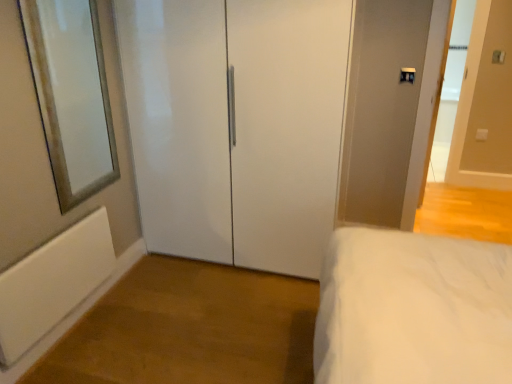
The height and width of the screenshot is (384, 512). What do you see at coordinates (485, 103) in the screenshot? I see `white glossy door at upper right, which is the first door in right-to-left order` at bounding box center [485, 103].

What do you see at coordinates (236, 126) in the screenshot? I see `white glossy closet doors at center, which is the second door in right-to-left order` at bounding box center [236, 126].

I want to click on white matte radiator at lower left, so [53, 283].

This screenshot has width=512, height=384. Identify the location of white glossy door at upper right, marked as the second door in a left-to-right arrangement. (485, 103).

Does white glossy closet doors at center, which is the second door in right-to-left order, lie behind white matte radiator at lower left?

Yes, white glossy closet doors at center, which is the second door in right-to-left order, is behind white matte radiator at lower left.

Is point (243, 245) positioned before point (49, 294)?

No, it is behind (49, 294).

Which of these two, white glossy closet doors at center, positioned as the 1th door in left-to-right order, or white matte radiator at lower left, stands taller?

With more height is white glossy closet doors at center, positioned as the 1th door in left-to-right order.

Does white glossy closet doors at center, which is the second door in right-to-left order, touch white matte radiator at lower left?

No, white glossy closet doors at center, which is the second door in right-to-left order, is not with white matte radiator at lower left.

Considering the positions of objects white glossy closet doors at center, positioned as the 1th door in left-to-right order, and silver-framed mirror at left in the image provided, who is more to the left, white glossy closet doors at center, positioned as the 1th door in left-to-right order, or silver-framed mirror at left?

From the viewer's perspective, silver-framed mirror at left appears more on the left side.

Is white glossy closet doors at center, which is the second door in right-to-left order, not within silver-framed mirror at left?

Yes, white glossy closet doors at center, which is the second door in right-to-left order, is not within silver-framed mirror at left.

Can you confirm if white glossy closet doors at center, positioned as the 1th door in left-to-right order, is bigger than silver-framed mirror at left?

Yes, white glossy closet doors at center, positioned as the 1th door in left-to-right order, is bigger than silver-framed mirror at left.

From a real-world perspective, does white glossy closet doors at center, which is the second door in right-to-left order, sit lower than silver-framed mirror at left?

Indeed, from a real-world perspective, white glossy closet doors at center, which is the second door in right-to-left order, is positioned beneath silver-framed mirror at left.

Where is `mirror to the right of white matte radiator at lower left`? The image size is (512, 384). mirror to the right of white matte radiator at lower left is located at coordinates click(71, 95).

Would you say white matte radiator at lower left contains silver-framed mirror at left?

No.

How distant is white matte radiator at lower left from silver-framed mirror at left?

white matte radiator at lower left and silver-framed mirror at left are 20.43 inches apart from each other.

Are white matte radiator at lower left and silver-framed mirror at left beside each other?

No, white matte radiator at lower left is not touching silver-framed mirror at left.

Considering the relative sizes of silver-framed mirror at left and white glossy closet doors at center, positioned as the 1th door in left-to-right order, in the image provided, is silver-framed mirror at left wider than white glossy closet doors at center, positioned as the 1th door in left-to-right order,?

No, silver-framed mirror at left is not wider than white glossy closet doors at center, positioned as the 1th door in left-to-right order.

You are a GUI agent. You are given a task and a screenshot of the screen. Output one action in this format:
    pyautogui.click(x=<x>, y=<y>)
    Task: Click on the mirror above the white glossy closet doors at center, positioned as the 1th door in left-to-right order (from a real-world perspective)
    
    Given the screenshot: What is the action you would take?
    [x=71, y=95]

Do you think silver-framed mirror at left is within white glossy closet doors at center, which is the second door in right-to-left order, or outside of it?

silver-framed mirror at left is located beyond the bounds of white glossy closet doors at center, which is the second door in right-to-left order.

Does white glossy closet doors at center, which is the second door in right-to-left order, turn towards white glossy door at upper right, marked as the second door in a left-to-right arrangement?

No, white glossy closet doors at center, which is the second door in right-to-left order, does not turn towards white glossy door at upper right, marked as the second door in a left-to-right arrangement.

Are white glossy closet doors at center, positioned as the 1th door in left-to-right order, and white glossy door at upper right, marked as the second door in a left-to-right arrangement, beside each other?

No, white glossy closet doors at center, positioned as the 1th door in left-to-right order, is not making contact with white glossy door at upper right, marked as the second door in a left-to-right arrangement.

From the image's perspective, is white glossy closet doors at center, positioned as the 1th door in left-to-right order, over white glossy door at upper right, which is the first door in right-to-left order?

No.

Considering the relative sizes of white glossy closet doors at center, which is the second door in right-to-left order, and white glossy door at upper right, marked as the second door in a left-to-right arrangement, in the image provided, is white glossy closet doors at center, which is the second door in right-to-left order, bigger than white glossy door at upper right, marked as the second door in a left-to-right arrangement,?

Correct, white glossy closet doors at center, which is the second door in right-to-left order, is larger in size than white glossy door at upper right, marked as the second door in a left-to-right arrangement.

Is white matte radiator at lower left positioned behind white glossy door at upper right, marked as the second door in a left-to-right arrangement?

That is False.

From the image's perspective, between white matte radiator at lower left and white glossy door at upper right, marked as the second door in a left-to-right arrangement, who is located below?

white matte radiator at lower left is shown below in the image.

Which is more to the right, white matte radiator at lower left or white glossy door at upper right, which is the first door in right-to-left order?

white glossy door at upper right, which is the first door in right-to-left order.

From a real-world perspective, is white matte radiator at lower left positioned under white glossy door at upper right, which is the first door in right-to-left order, based on gravity?

Yes, from a real-world perspective, white matte radiator at lower left is beneath white glossy door at upper right, which is the first door in right-to-left order.

Which of these two, white glossy door at upper right, marked as the second door in a left-to-right arrangement, or silver-framed mirror at left, stands taller?

Standing taller between the two is white glossy door at upper right, marked as the second door in a left-to-right arrangement.

Is white glossy door at upper right, marked as the second door in a left-to-right arrangement, with silver-framed mirror at left?

No, white glossy door at upper right, marked as the second door in a left-to-right arrangement, is not in contact with silver-framed mirror at left.

From a real-world perspective, is white glossy door at upper right, which is the first door in right-to-left order, physically below silver-framed mirror at left?

Correct, in the physical world, white glossy door at upper right, which is the first door in right-to-left order, is lower than silver-framed mirror at left.

Find the location of a particular element. This screenshot has width=512, height=384. radiator in front of the white glossy closet doors at center, positioned as the 1th door in left-to-right order is located at coordinates (53, 283).

This screenshot has width=512, height=384. I want to click on the 2nd door located beneath the silver-framed mirror at left (from a real-world perspective), so click(236, 126).

Which object lies nearer to the anchor point white glossy door at upper right, which is the first door in right-to-left order, white glossy closet doors at center, positioned as the 1th door in left-to-right order, or silver-framed mirror at left?

white glossy closet doors at center, positioned as the 1th door in left-to-right order, is positioned closer to the anchor white glossy door at upper right, which is the first door in right-to-left order.

Estimate the real-world distances between objects in this image. Which object is further from silver-framed mirror at left, white glossy closet doors at center, positioned as the 1th door in left-to-right order, or white matte radiator at lower left?

Among the two, white glossy closet doors at center, positioned as the 1th door in left-to-right order, is located further to silver-framed mirror at left.

Looking at this image, estimate the real-world distances between objects in this image. Which object is further from white glossy closet doors at center, positioned as the 1th door in left-to-right order, white glossy door at upper right, which is the first door in right-to-left order, or silver-framed mirror at left?

white glossy door at upper right, which is the first door in right-to-left order, lies further to white glossy closet doors at center, positioned as the 1th door in left-to-right order, than the other object.

Estimate the real-world distances between objects in this image. Which object is further from white glossy door at upper right, marked as the second door in a left-to-right arrangement, white matte radiator at lower left or silver-framed mirror at left?

Based on the image, white matte radiator at lower left appears to be further to white glossy door at upper right, marked as the second door in a left-to-right arrangement.

From the picture: From the image, which object appears to be nearer to white matte radiator at lower left, silver-framed mirror at left or white glossy closet doors at center, positioned as the 1th door in left-to-right order?

silver-framed mirror at left lies closer to white matte radiator at lower left than the other object.

From the image, which object appears to be farther from white matte radiator at lower left, white glossy door at upper right, marked as the second door in a left-to-right arrangement, or white glossy closet doors at center, which is the second door in right-to-left order?

The object further to white matte radiator at lower left is white glossy door at upper right, marked as the second door in a left-to-right arrangement.

From the image, which object appears to be farther from white glossy door at upper right, marked as the second door in a left-to-right arrangement, silver-framed mirror at left or white glossy closet doors at center, which is the second door in right-to-left order?

silver-framed mirror at left is further to white glossy door at upper right, marked as the second door in a left-to-right arrangement.

Based on their spatial positions, is silver-framed mirror at left or white matte radiator at lower left closer to white glossy door at upper right, marked as the second door in a left-to-right arrangement?

silver-framed mirror at left lies closer to white glossy door at upper right, marked as the second door in a left-to-right arrangement, than the other object.

This screenshot has width=512, height=384. Identify the location of door situated between white matte radiator at lower left and white glossy door at upper right, marked as the second door in a left-to-right arrangement, from left to right. (236, 126).

Locate an element on the screen. The height and width of the screenshot is (384, 512). mirror between white matte radiator at lower left and white glossy closet doors at center, which is the second door in right-to-left order is located at coordinates (71, 95).

The width and height of the screenshot is (512, 384). What are the coordinates of `door between silver-framed mirror at left and white glossy door at upper right, which is the first door in right-to-left order, from left to right` in the screenshot? It's located at (236, 126).

Image resolution: width=512 pixels, height=384 pixels. In order to click on mirror located between white matte radiator at lower left and white glossy door at upper right, marked as the second door in a left-to-right arrangement, in the left-right direction in this screenshot , I will do `click(71, 95)`.